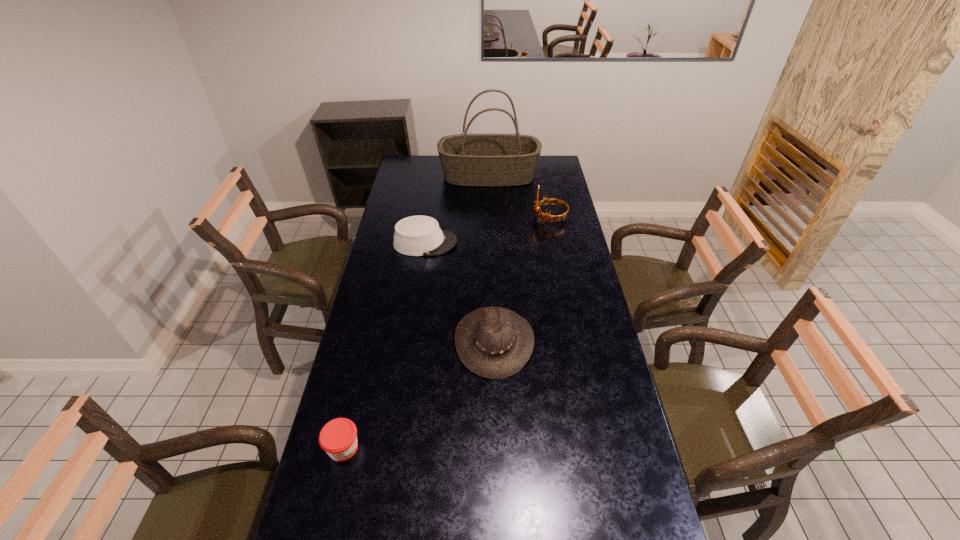
Where is `free spot located 0.100m on the left of the tallest object`? The image size is (960, 540). free spot located 0.100m on the left of the tallest object is located at coordinates (420, 176).

Identify the location of free space located 0.300m on the front-facing side of the fourth nearest object. The image size is (960, 540). (470, 218).

Identify the location of free space located on the front-facing side of the fourth nearest object. The width and height of the screenshot is (960, 540). (517, 218).

The width and height of the screenshot is (960, 540). I want to click on vacant space situated 0.080m on the front-facing side of the fourth nearest object, so [516, 218].

Find the location of a particular element. vacant area located on the front-facing side of the right hat is located at coordinates (376, 341).

This screenshot has width=960, height=540. Find the location of `vacant area situated on the front-facing side of the right hat`. vacant area situated on the front-facing side of the right hat is located at coordinates (441, 341).

At what (x,y) coordinates should I click in order to perform the action: click on free location located 0.300m on the front-facing side of the right hat. Please return your answer as a coordinate pair (x, y). The image size is (960, 540). Looking at the image, I should click on (372, 341).

Image resolution: width=960 pixels, height=540 pixels. I want to click on vacant space situated 0.090m on the front-facing side of the third nearest object, so click(x=477, y=243).

Locate an element on the screen. The width and height of the screenshot is (960, 540). free space located 0.360m on the label side of the jam is located at coordinates (485, 448).

Find the location of `object present at the far edge`. object present at the far edge is located at coordinates (485, 160).